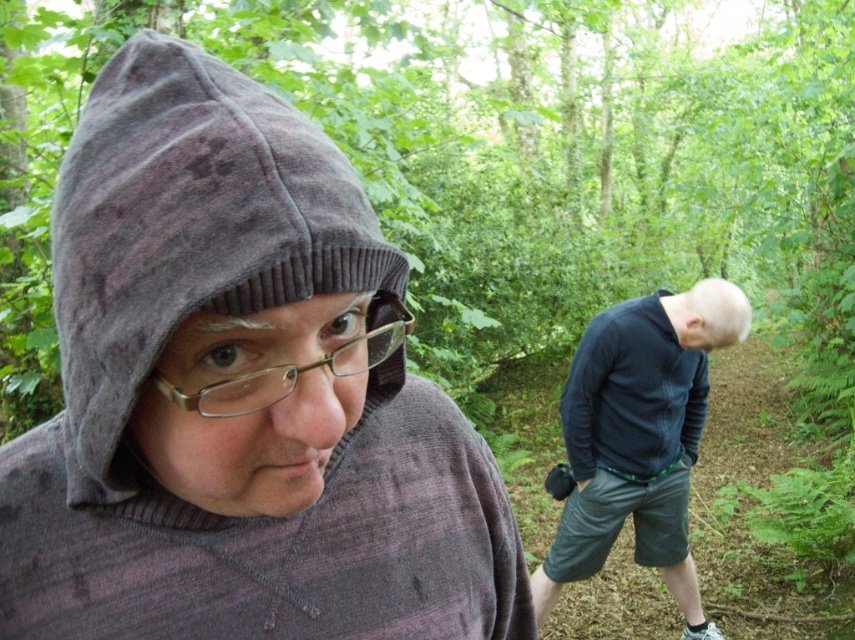
Question: Does dark blue sweater at center have a greater width compared to metallic gold glasses at center?

Choices:
 (A) no
 (B) yes

Answer: (B)

Question: Does velvety gray hood at left have a larger size compared to metallic gold glasses at center?

Choices:
 (A) yes
 (B) no

Answer: (A)

Question: Which object is closer to the camera taking this photo?

Choices:
 (A) velvety gray hood at left
 (B) metallic gold glasses at center
 (C) dark blue sweater at center

Answer: (A)

Question: Which point is closer to the camera taking this photo?

Choices:
 (A) (202, 129)
 (B) (670, 317)

Answer: (A)

Question: Which object is closer to the camera taking this photo?

Choices:
 (A) metallic gold glasses at center
 (B) dark blue sweater at center

Answer: (A)

Question: Can you confirm if velvety gray hood at left is thinner than dark blue sweater at center?

Choices:
 (A) yes
 (B) no

Answer: (A)